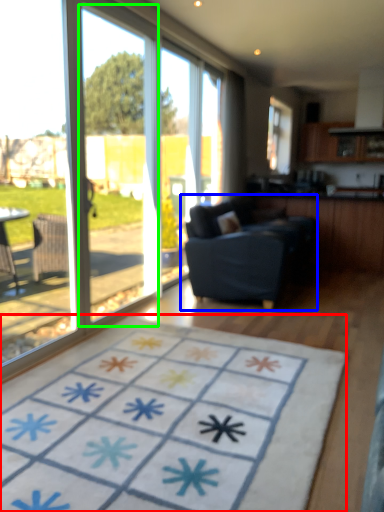
Question: Based on their relative distances, which object is farther from doormat (highlighted by a red box)? Choose from studio couch (highlighted by a blue box) and screen door (highlighted by a green box).

Choices:
 (A) studio couch
 (B) screen door

Answer: (B)